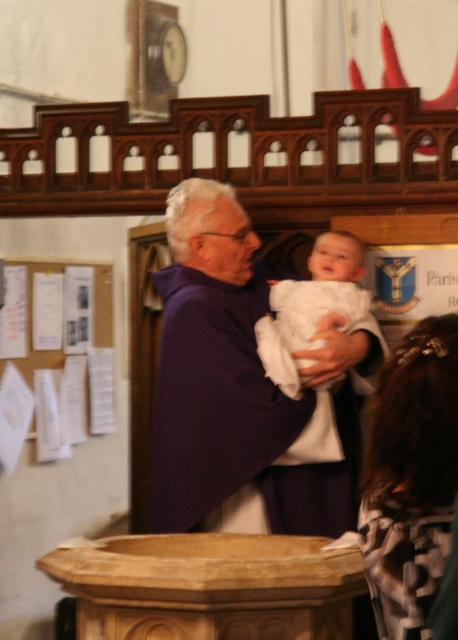
How far apart are purple clothed man at center and white clothed baby at center?

purple clothed man at center and white clothed baby at center are 7.52 inches apart.

The width and height of the screenshot is (458, 640). In order to click on purple clothed man at center in this screenshot , I will do tap(243, 390).

Does point (244, 413) lie behind point (299, 509)?

No.

The height and width of the screenshot is (640, 458). Identify the location of purple clothed man at center. (243, 390).